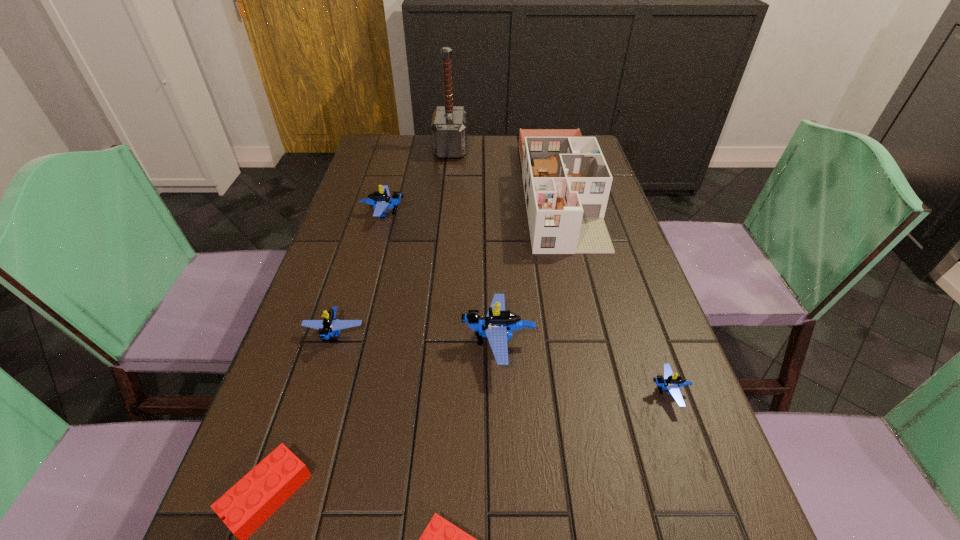
The image size is (960, 540). I want to click on blank region between the fifth tallest object and the third smallest blue Lego, so click(360, 274).

Image resolution: width=960 pixels, height=540 pixels. I want to click on blank region between the second smallest blue Lego and the hammer, so click(x=393, y=242).

Where is `free space between the farthest Lego and the fourth tallest Lego`? free space between the farthest Lego and the fourth tallest Lego is located at coordinates (527, 303).

Locate an element on the screen. This screenshot has width=960, height=540. free spot between the biggest blue Lego and the fourth shortest Lego is located at coordinates (417, 339).

Where is `object that is the third closest to the third biggest blue Lego`? Image resolution: width=960 pixels, height=540 pixels. object that is the third closest to the third biggest blue Lego is located at coordinates (381, 199).

The width and height of the screenshot is (960, 540). Find the location of `object that is the seventh closest to the rightmost blue Lego`. object that is the seventh closest to the rightmost blue Lego is located at coordinates (449, 123).

Identify which Lego is the nearest to the rightmost Lego. Please provide its 2D coordinates. Your answer should be formatted as a tuple, i.e. [(x, y)], where the tuple contains the x and y coordinates of a point satisfying the conditions above.

[(497, 326)]

Where is `Lego that stands as the third closest to the fifth tallest Lego`? This screenshot has width=960, height=540. Lego that stands as the third closest to the fifth tallest Lego is located at coordinates (497, 326).

Locate an element on the screen. blue Lego that is the second closest one to the biggest blue Lego is located at coordinates (329, 325).

Choose which blue Lego is the third nearest neighbor to the shortest object. Please provide its 2D coordinates. Your answer should be formatted as a tuple, i.e. [(x, y)], where the tuple contains the x and y coordinates of a point satisfying the conditions above.

[(670, 382)]